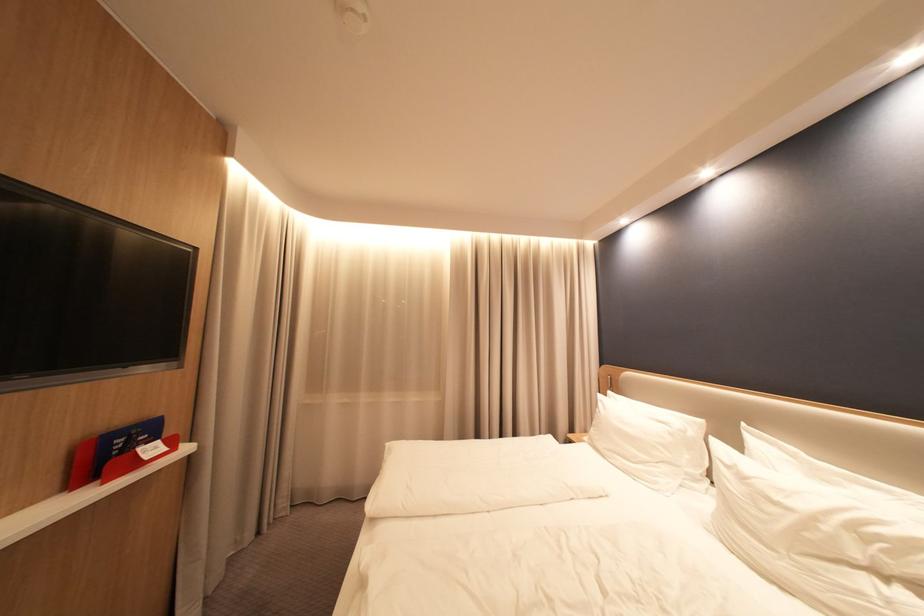
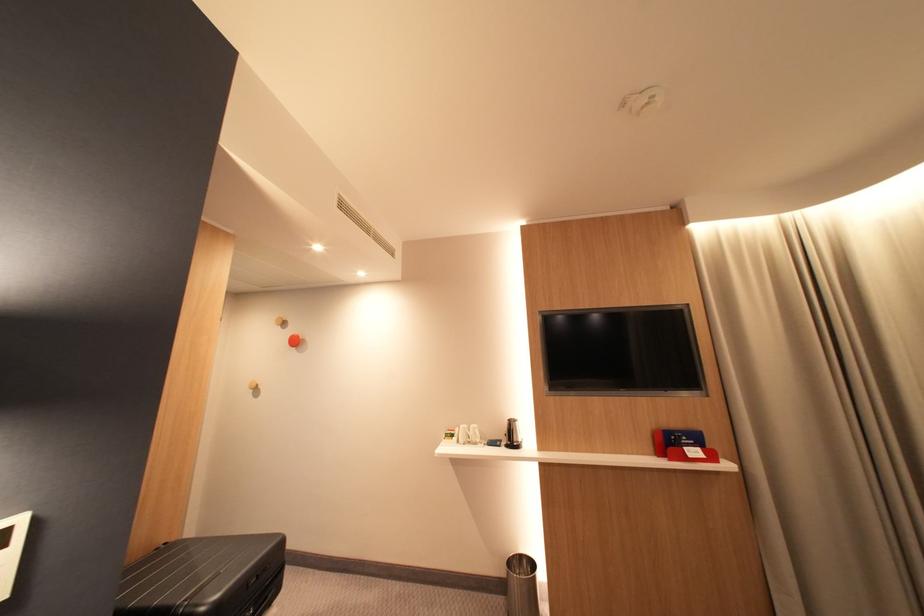
Where in the second image is the point corresponding to (x=150, y=452) from the first image?

(696, 450)